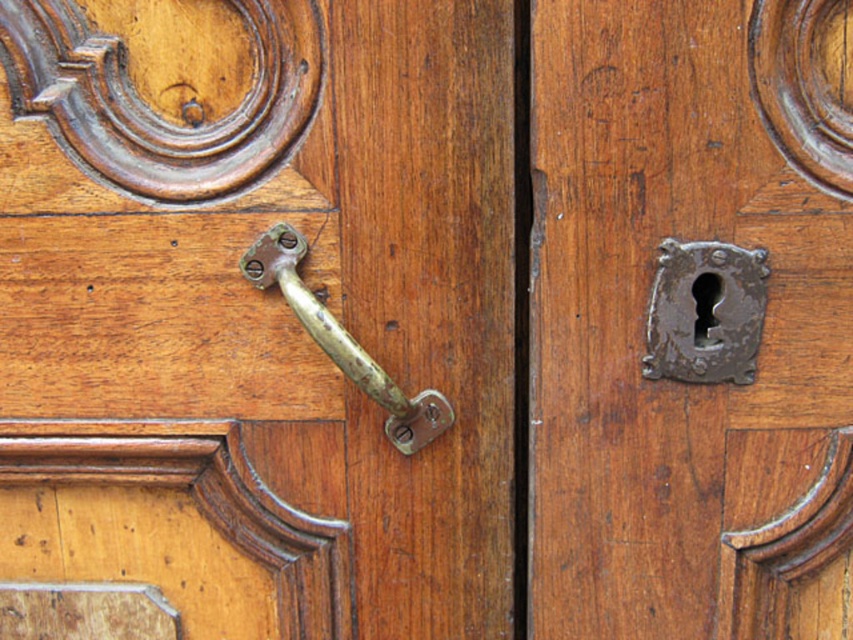
You are a locksmith examining a wooden door with two rusty metal keyholes. The keyholes are labeled as the rusty metal keyhole at center and the rusty metal keyhole at right. From your perspective, which keyhole is located to the left?

The rusty metal keyhole at center is positioned on the left side of the rusty metal keyhole at right.

You are trying to unlock the door and notice both the rusty metal keyhole at right and the gold polished metal door handle at center. Which object is shorter in height?

The rusty metal keyhole at right is shorter in height than the gold polished metal door handle at center.

You are a painter standing at the door and want to place a sticker exactly halfway between the point at point (722,118) and the door handle. Where should you place the sticker?

The sticker should be placed at the midpoint between the point at point (722,118) and the door handle. Since they are 34.61 inches apart, the midpoint would be approximately 17.305 inches from each point.